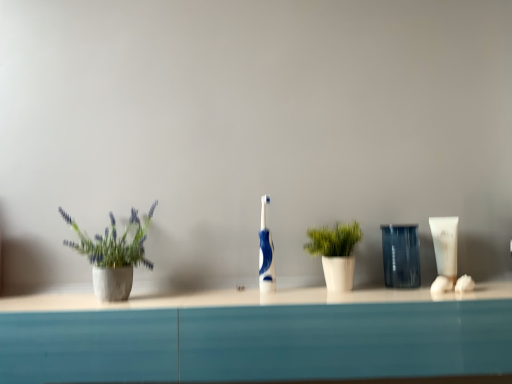
Question: Looking at their shapes, would you say transparent plastic cup at center is wider or thinner than blue glossy toothbrush at center?

Choices:
 (A) wide
 (B) thin

Answer: (A)

Question: From the image's perspective, relative to blue glossy toothbrush at center, is transparent plastic cup at center above or below?

Choices:
 (A) below
 (B) above

Answer: (A)

Question: Which object is the closest to the white matte plant pot at center, the second houseplant when ordered from left to right?

Choices:
 (A) transparent plastic cup at center
 (B) matte concrete pot at left, which is the first houseplant in left-to-right order
 (C) blue glossy toothbrush at center
 (D) white matte tube at right

Answer: (A)

Question: Based on their relative distances, which object is farther from the blue glossy toothbrush at center?

Choices:
 (A) transparent plastic cup at center
 (B) white matte plant pot at center, which ranks as the first houseplant in right-to-left order
 (C) white matte tube at right
 (D) matte concrete pot at left, which is the first houseplant in left-to-right order

Answer: (C)